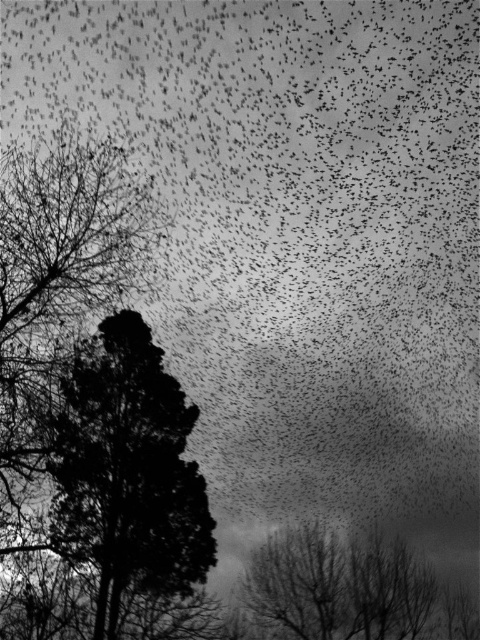
Consider the image. You are an ornithologist observing the flock of birds. You notice two trees in the foreground. Which tree has a narrower trunk? The black textured tree at center or the bare branches at lower center?

The black textured tree at center is thinner than the bare branches at lower center, so the black textured tree at center has a narrower trunk.

You are an ornithologist observing the flock of birds in the image. You notice two points in the sky where birds are gathering. The points are labeled as point 1 at coordinates point 1 at coordinates point (119,580) and point 2 at coordinates point (328,572). Which point is closer to you?

Point (119,580) is closer to the viewer than point (328,572).